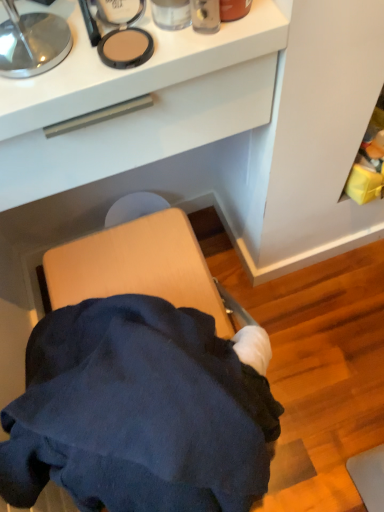
Locate an element on the screen. This screenshot has width=384, height=512. matte plastic container at upper center is located at coordinates (171, 14).

Image resolution: width=384 pixels, height=512 pixels. Describe the element at coordinates (171, 14) in the screenshot. I see `matte plastic container at upper center` at that location.

Where is `white matte drawer at upper center`? white matte drawer at upper center is located at coordinates (139, 133).

The image size is (384, 512). Describe the element at coordinates (139, 133) in the screenshot. I see `white matte drawer at upper center` at that location.

In order to click on matte plastic container at upper center in this screenshot , I will do `click(171, 14)`.

Based on their positions, is white matte drawer at upper center located to the left or right of matte plastic container at upper center?

white matte drawer at upper center is positioned on matte plastic container at upper center's left side.

Considering the relative positions of white matte drawer at upper center and matte plastic container at upper center in the image provided, is white matte drawer at upper center in front of matte plastic container at upper center?

That is True.

From the picture: Which is more distant, (x=258, y=89) or (x=170, y=4)?

The point (x=258, y=89) is farther from the camera.

From the image's perspective, is white matte drawer at upper center located above or below matte plastic container at upper center?

Clearly, from the image's perspective, white matte drawer at upper center is below matte plastic container at upper center.

From a real-world perspective, who is located higher, white matte drawer at upper center or matte plastic container at upper center?

matte plastic container at upper center is physically above.

Can you confirm if white matte drawer at upper center is wider than matte plastic container at upper center?

Yes.

Does white matte drawer at upper center have a lesser height compared to matte plastic container at upper center?

In fact, white matte drawer at upper center may be taller than matte plastic container at upper center.

Does white matte drawer at upper center have a larger size compared to matte plastic container at upper center?

Yes.

Would you say matte plastic container at upper center is part of white matte drawer at upper center's contents?

No, white matte drawer at upper center does not contain matte plastic container at upper center.

Based on the photo, is white matte drawer at upper center not near matte plastic container at upper center?

That's not correct — white matte drawer at upper center is a little close to matte plastic container at upper center.

Is matte plastic container at upper center at the back of white matte drawer at upper center?

white matte drawer at upper center does not have its back to matte plastic container at upper center.

What are the coordinates of `drawer located in front of the matte plastic container at upper center` in the screenshot? It's located at (139, 133).

Can you confirm if matte plastic container at upper center is positioned to the right of white matte drawer at upper center?

Correct, you'll find matte plastic container at upper center to the right of white matte drawer at upper center.

Is the depth of matte plastic container at upper center greater than that of white matte drawer at upper center?

Yes, matte plastic container at upper center is behind white matte drawer at upper center.

Is point (158, 9) in front of point (120, 155)?

Yes, it is in front of point (120, 155).

From the image's perspective, relative to white matte drawer at upper center, is matte plastic container at upper center above or below?

Clearly, from the image's perspective, matte plastic container at upper center is above white matte drawer at upper center.

From a real-world perspective, which object stands above the other?

In real-world perspective, matte plastic container at upper center is above.

Can you confirm if matte plastic container at upper center is wider than white matte drawer at upper center?

No, matte plastic container at upper center is not wider than white matte drawer at upper center.

Which of these two, matte plastic container at upper center or white matte drawer at upper center, stands taller?

With more height is white matte drawer at upper center.

Is matte plastic container at upper center smaller than white matte drawer at upper center?

Yes.

Is matte plastic container at upper center outside of white matte drawer at upper center?

Yes, matte plastic container at upper center is not within white matte drawer at upper center.

Is matte plastic container at upper center in contact with white matte drawer at upper center?

matte plastic container at upper center is not next to white matte drawer at upper center, and they're not touching.

Could you tell me if matte plastic container at upper center is turned towards white matte drawer at upper center?

No, matte plastic container at upper center is not turned towards white matte drawer at upper center.

Can you tell me how much matte plastic container at upper center and white matte drawer at upper center differ in facing direction?

2.18 degrees separate the facing orientations of matte plastic container at upper center and white matte drawer at upper center.

Where is `drawer lying in front of the matte plastic container at upper center`? drawer lying in front of the matte plastic container at upper center is located at coordinates (139, 133).

Find the location of a particular element. This screenshot has width=384, height=512. toiletry behind the white matte drawer at upper center is located at coordinates (171, 14).

Locate an element on the screen. This screenshot has height=512, width=384. toiletry above the white matte drawer at upper center (from a real-world perspective) is located at coordinates (171, 14).